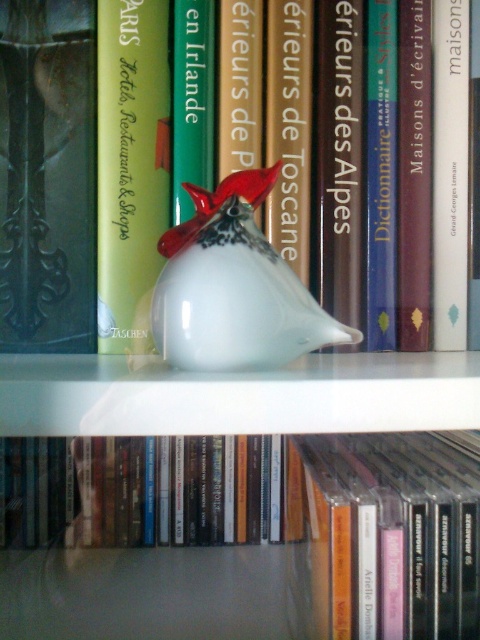
Does hardcover book at center appear on the right side of white glass vase at center?

Incorrect, hardcover book at center is not on the right side of white glass vase at center.

Who is higher up, hardcover book at center or white glass vase at center?

Positioned higher is white glass vase at center.

Describe the element at coordinates (245, 544) in the screenshot. I see `hardcover book at center` at that location.

What are the coordinates of `hardcover book at center` in the screenshot? It's located at (245, 544).